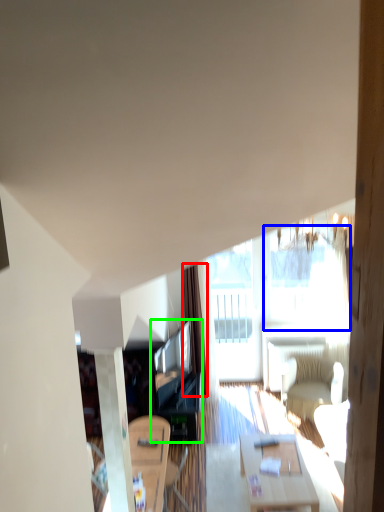
Question: Which is farther away from curtain (highlighted by a red box)? window (highlighted by a blue box) or entertainment center (highlighted by a green box)?

Choices:
 (A) window
 (B) entertainment center

Answer: (A)